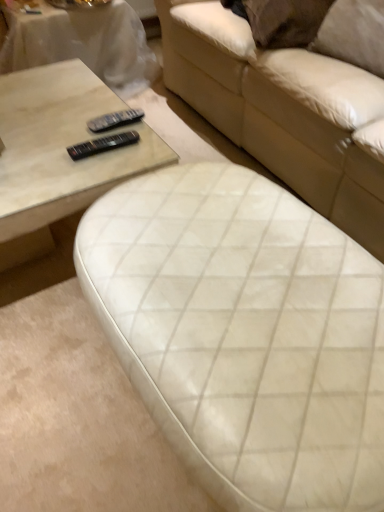
Question: Is black plastic remote at center, the second remote positioned from the top, looking in the opposite direction of matte white coffee table at upper left?

Choices:
 (A) yes
 (B) no

Answer: (A)

Question: From the image's perspective, does black plastic remote at center, the second remote positioned from the top, appear higher than matte white coffee table at upper left?

Choices:
 (A) no
 (B) yes

Answer: (A)

Question: Is black plastic remote at center, the second remote positioned from the top, directly adjacent to matte white coffee table at upper left?

Choices:
 (A) no
 (B) yes

Answer: (A)

Question: Does black plastic remote at center, which is counted as the 1th remote, starting from the bottom, appear on the right side of matte white coffee table at upper left?

Choices:
 (A) yes
 (B) no

Answer: (A)

Question: Considering the relative sizes of black plastic remote at center, the second remote positioned from the top, and matte white coffee table at upper left in the image provided, is black plastic remote at center, the second remote positioned from the top, bigger than matte white coffee table at upper left?

Choices:
 (A) yes
 (B) no

Answer: (B)

Question: Considering the relative positions of black plastic remote at center, which is counted as the 1th remote, starting from the bottom, and matte white coffee table at upper left in the image provided, is black plastic remote at center, which is counted as the 1th remote, starting from the bottom, behind matte white coffee table at upper left?

Choices:
 (A) yes
 (B) no

Answer: (B)

Question: Is matte glass coffee table at center facing away from black plastic remote at center, the second remote positioned from the top?

Choices:
 (A) yes
 (B) no

Answer: (B)

Question: Is matte glass coffee table at center not close to black plastic remote at center, the second remote positioned from the top?

Choices:
 (A) no
 (B) yes

Answer: (A)

Question: From the image's perspective, would you say matte glass coffee table at center is shown under black plastic remote at center, the second remote positioned from the top?

Choices:
 (A) yes
 (B) no

Answer: (A)

Question: Does matte glass coffee table at center have a lesser width compared to black plastic remote at center, which is counted as the 1th remote, starting from the bottom?

Choices:
 (A) no
 (B) yes

Answer: (A)

Question: From a real-world perspective, is matte glass coffee table at center located beneath black plastic remote at center, the second remote positioned from the top?

Choices:
 (A) yes
 (B) no

Answer: (A)

Question: Is matte glass coffee table at center taller than black plastic remote at center, the second remote positioned from the top?

Choices:
 (A) yes
 (B) no

Answer: (A)

Question: Is matte glass coffee table at center positioned behind matte white coffee table at upper left?

Choices:
 (A) no
 (B) yes

Answer: (A)